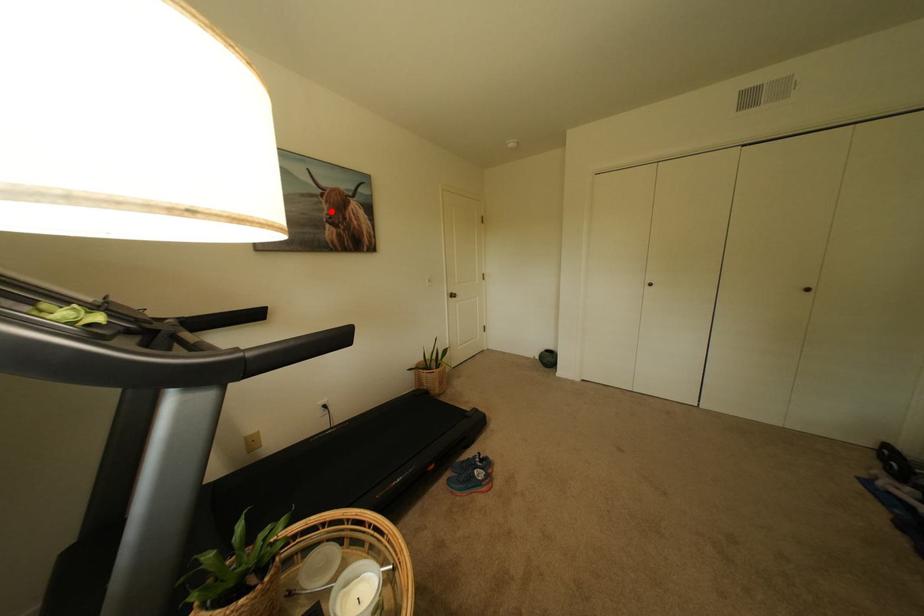
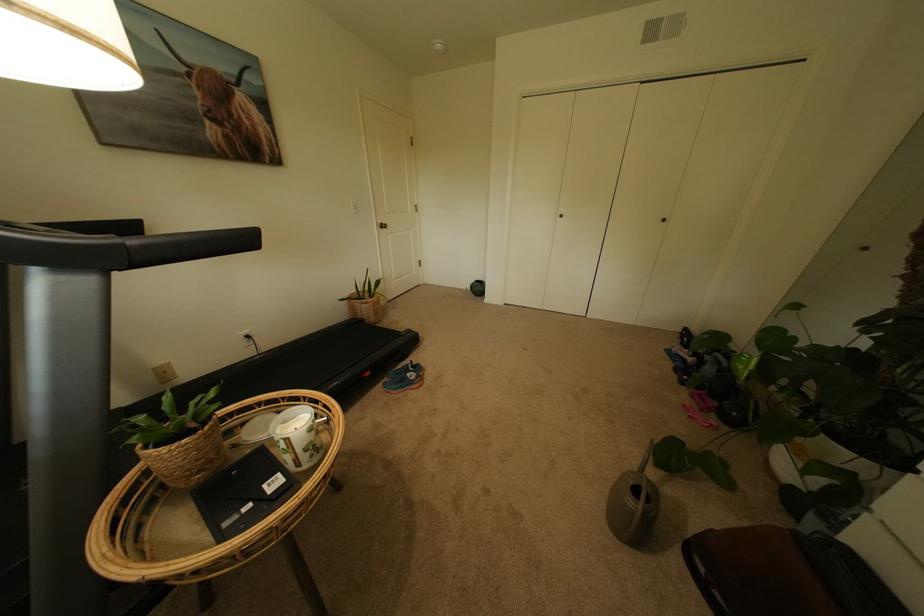
Locate, in the second image, the point that corresponds to the highlighted location in the first image.

(204, 100)